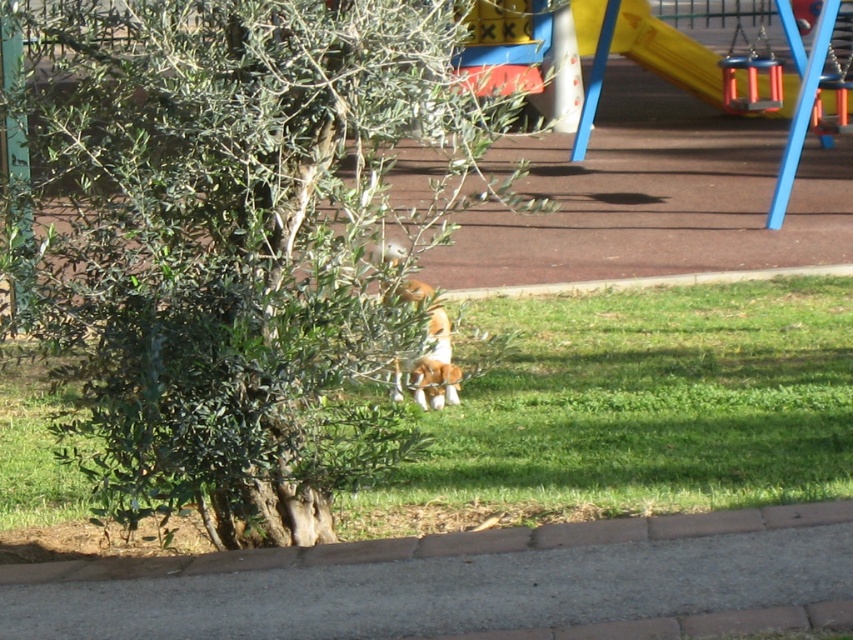
Can you confirm if green leafy tree at center is bigger than brown fur dog at center?

Correct, green leafy tree at center is larger in size than brown fur dog at center.

Who is lower down, green leafy tree at center or brown fur dog at center?

brown fur dog at center

Is point (222, 115) positioned after point (427, 403)?

No, (222, 115) is closer to viewer.

Where is `green leafy tree at center`? green leafy tree at center is located at coordinates click(x=238, y=243).

Can you confirm if green grass at center is thinner than brown fur dog at center?

No, green grass at center is not thinner than brown fur dog at center.

What do you see at coordinates (636, 410) in the screenshot?
I see `green grass at center` at bounding box center [636, 410].

Who is more forward, (10, 532) or (439, 388)?

Point (10, 532) is more forward.

What are the coordinates of `green grass at center` in the screenshot? It's located at (636, 410).

Does point (148, 182) lie behind point (602, 410)?

No.

This screenshot has width=853, height=640. Describe the element at coordinates (238, 243) in the screenshot. I see `green leafy tree at center` at that location.

The height and width of the screenshot is (640, 853). In order to click on green leafy tree at center in this screenshot , I will do `click(238, 243)`.